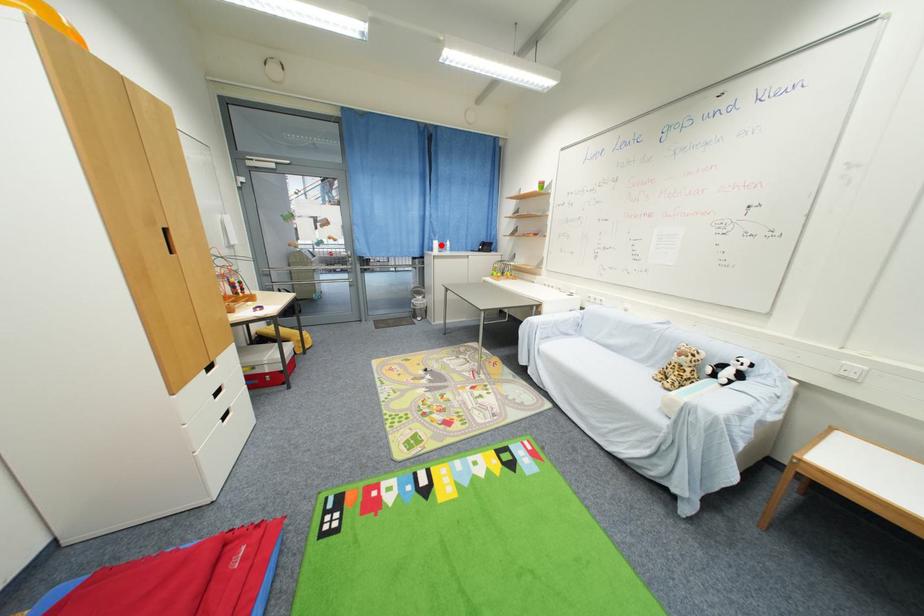
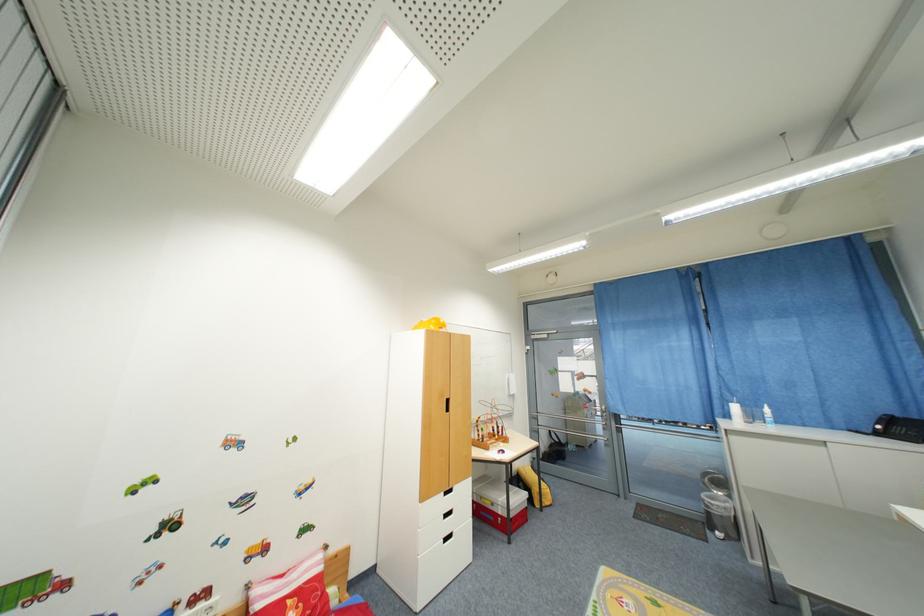
Question: I am providing you with two images of the same scene from different viewpoints. A red point is shown in image1. For the corresponding object point in image2, is it positioned nearer or farther from the camera?

Choices:
 (A) Nearer
 (B) Farther

Answer: (B)